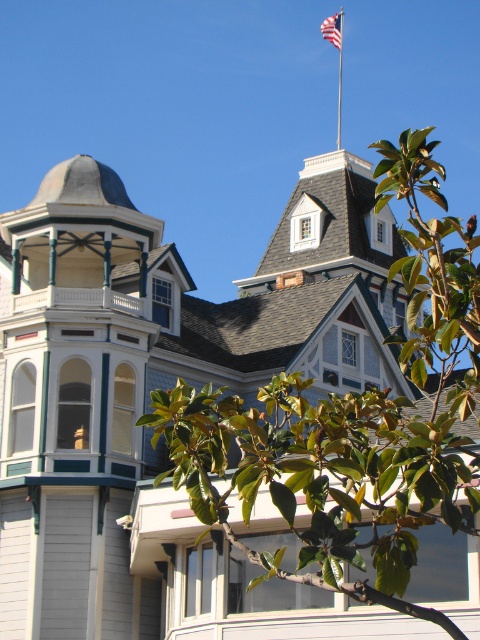
Does green leafy tree at upper center appear on the left side of metallic flag pole at upper center?

Correct, you'll find green leafy tree at upper center to the left of metallic flag pole at upper center.

Is green leafy tree at upper center above metallic flag pole at upper center?

Actually, green leafy tree at upper center is below metallic flag pole at upper center.

Does point (217, 492) lie in front of point (340, 22)?

Yes, it is.

You are a GUI agent. You are given a task and a screenshot of the screen. Output one action in this format:
    pyautogui.click(x=<x>, y=<y>)
    Task: Click on the green leafy tree at upper center
    Image resolution: width=480 pixels, height=640 pixels.
    Given the screenshot: What is the action you would take?
    pyautogui.click(x=351, y=426)

Does metallic flag pole at upper center have a greater width compared to american flag at upper center?

No, metallic flag pole at upper center is not wider than american flag at upper center.

Locate an element on the screen. This screenshot has height=640, width=480. metallic flag pole at upper center is located at coordinates (339, 74).

Can you confirm if green leafy tree at upper center is shorter than american flag at upper center?

Incorrect, green leafy tree at upper center's height does not fall short of american flag at upper center's.

Is point (201, 484) closer to viewer compared to point (342, 22)?

Yes, point (201, 484) is in front of point (342, 22).

Is point (398, 196) in front of point (340, 26)?

Yes, it is.

Image resolution: width=480 pixels, height=640 pixels. I want to click on green leafy tree at upper center, so click(351, 426).